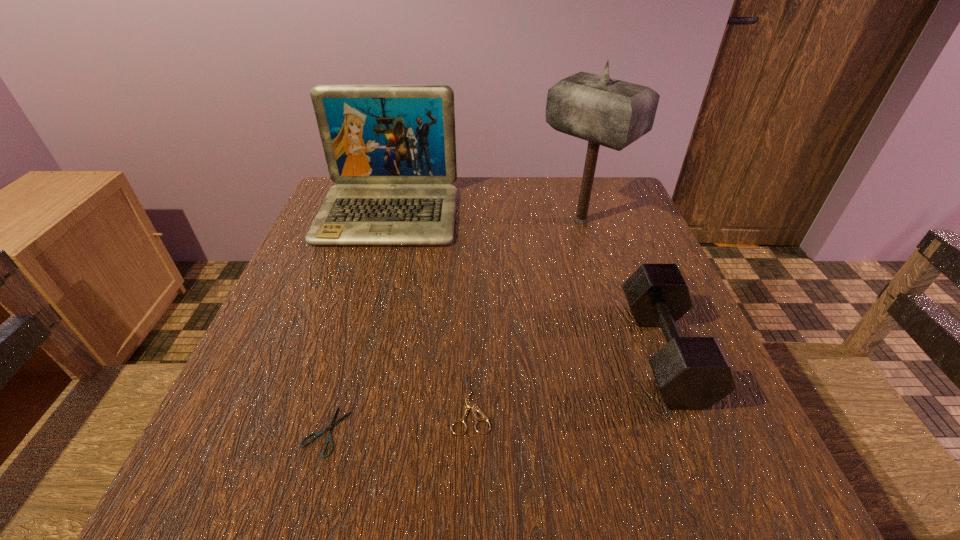
Locate an element on the screen. The width and height of the screenshot is (960, 540). blank space that satisfies the following two spatial constraints: 1. on the back side of the shortest object; 2. on the left side of the third object from right to left is located at coordinates (334, 403).

This screenshot has height=540, width=960. Find the location of `vacant space that satisfies the following two spatial constraints: 1. on the screen of the fourth shortest object; 2. on the right side of the dumbbell`. vacant space that satisfies the following two spatial constraints: 1. on the screen of the fourth shortest object; 2. on the right side of the dumbbell is located at coordinates (348, 352).

This screenshot has width=960, height=540. I want to click on vacant space that satisfies the following two spatial constraints: 1. on the screen of the second tallest object; 2. on the right side of the third shortest object, so tap(348, 352).

The width and height of the screenshot is (960, 540). Identify the location of free spot that satisfies the following two spatial constraints: 1. on the screen of the second tallest object; 2. on the right side of the third tallest object. (348, 352).